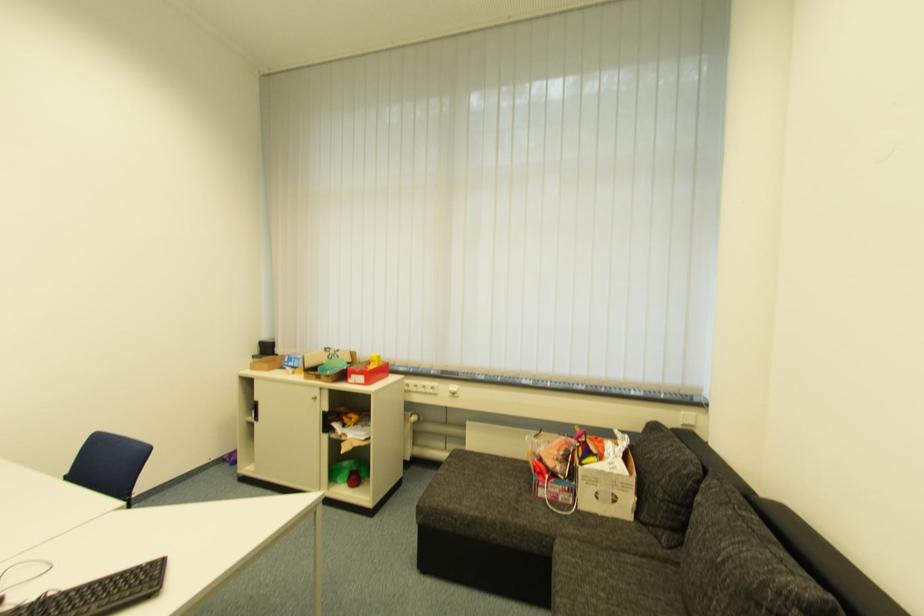
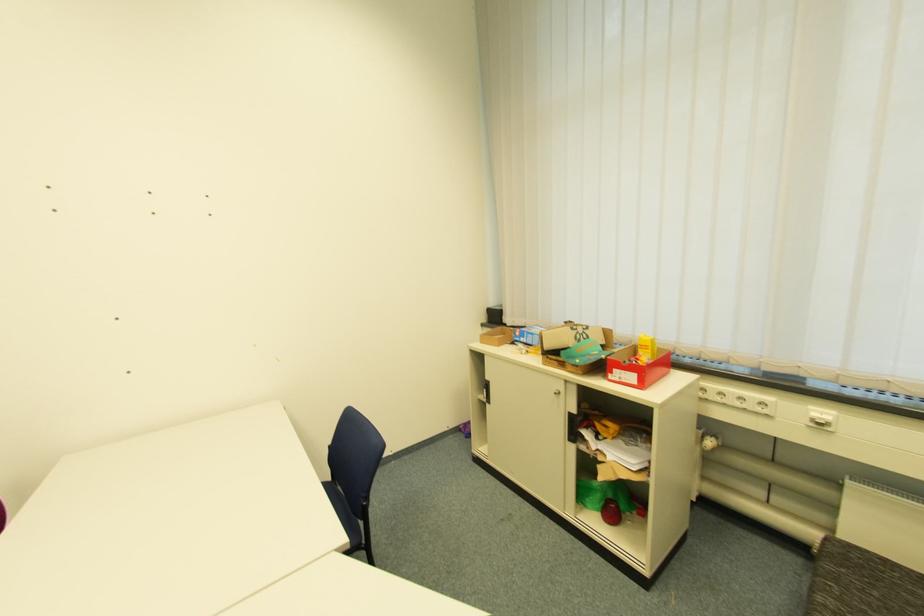
Question: The camera is either moving clockwise (left) or counter-clockwise (right) around the object. The first image is from the beginning of the video and the second image is from the end. Is the camera moving left or right when shooting the video?

Choices:
 (A) Left
 (B) Right

Answer: (B)